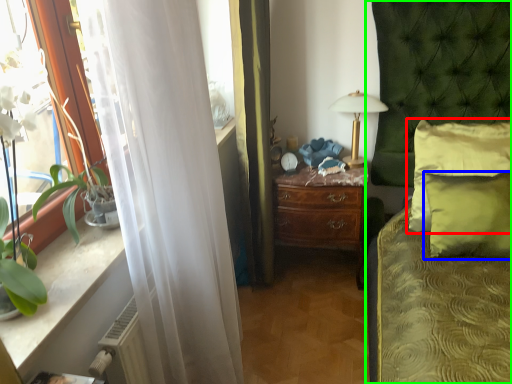
Question: Which object is positioned farthest from pillow (highlighted by a red box)? Select from pillow (highlighted by a blue box) and bed (highlighted by a green box).

Choices:
 (A) pillow
 (B) bed

Answer: (B)